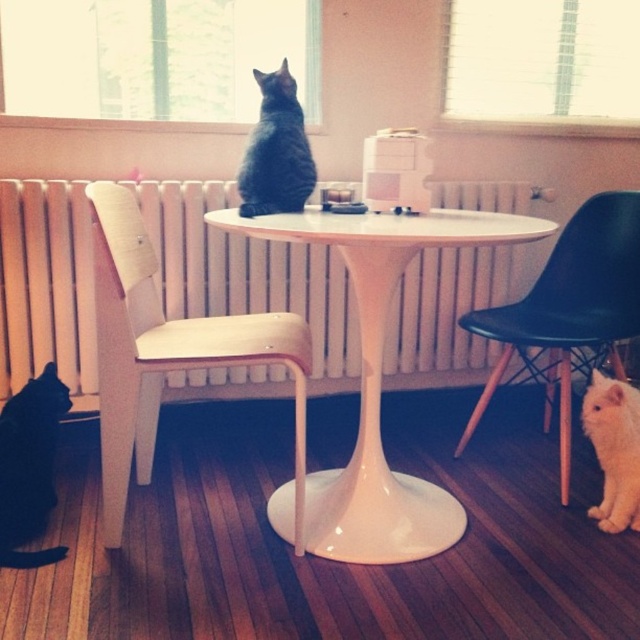
Question: Is white painted metal radiator at center positioned before gray fur cat at center?

Choices:
 (A) no
 (B) yes

Answer: (A)

Question: Based on their relative distances, which object is farther from the black plastic chair at lower right?

Choices:
 (A) white fluffy cat at lower right
 (B) white glossy table at center
 (C) black fur cat at lower left
 (D) white painted metal radiator at center

Answer: (C)

Question: Which point appears closest to the camera in this image?

Choices:
 (A) (605, 397)
 (B) (536, 310)

Answer: (A)

Question: Does white painted metal radiator at center appear on the right side of white wood chair at left?

Choices:
 (A) yes
 (B) no

Answer: (A)

Question: Which point is closer to the camera?

Choices:
 (A) (259, 72)
 (B) (44, 474)

Answer: (B)

Question: Does white glossy table at center have a lesser width compared to white wood chair at left?

Choices:
 (A) yes
 (B) no

Answer: (B)